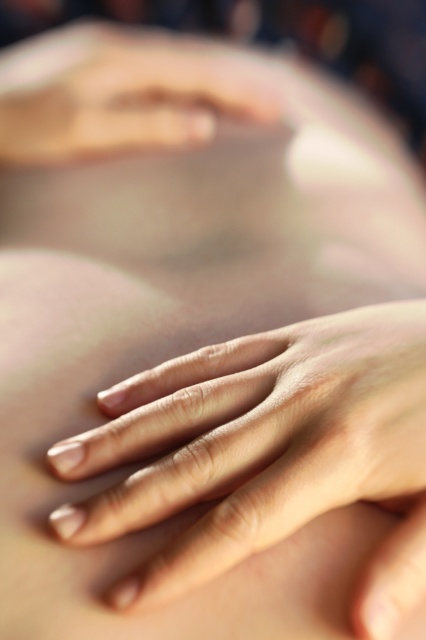
Who is shorter, smooth skin hand at center or smooth skin hand at upper center?

With less height is smooth skin hand at center.

Is point (342, 465) farther from camera compared to point (85, 100)?

No, (342, 465) is closer to viewer.

I want to click on smooth skin hand at center, so click(265, 452).